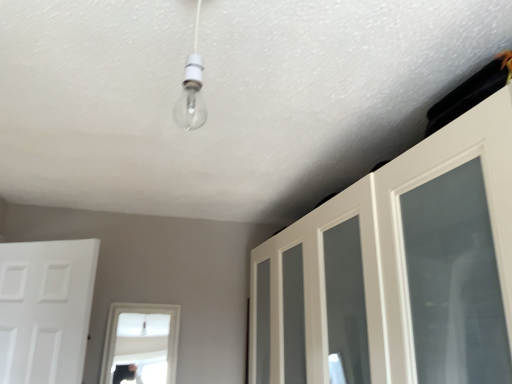
Question: In terms of width, does white matte door at left, the first door viewed from the left, look wider or thinner when compared to white glossy cabinet at upper right, which appears as the 1th door when viewed from the right?

Choices:
 (A) thin
 (B) wide

Answer: (A)

Question: Is white matte door at left, the second door when ordered from right to left, taller or shorter than white glossy cabinet at upper right, which appears as the 1th door when viewed from the right?

Choices:
 (A) tall
 (B) short

Answer: (B)

Question: From a real-world perspective, relative to white glossy cabinet at upper right, which appears as the 1th door when viewed from the right, is white matte door at left, the second door when ordered from right to left, vertically above or below?

Choices:
 (A) above
 (B) below

Answer: (B)

Question: Looking at the image, does white glossy cabinet at upper right, marked as the 2th door in a left-to-right arrangement, seem bigger or smaller compared to white matte door at left, the second door when ordered from right to left?

Choices:
 (A) small
 (B) big

Answer: (B)

Question: From a real-world perspective, relative to white matte door at left, the first door viewed from the left, is white glossy cabinet at upper right, marked as the 2th door in a left-to-right arrangement, vertically above or below?

Choices:
 (A) above
 (B) below

Answer: (A)

Question: Is point (293, 332) closer or farther from the camera than point (51, 243)?

Choices:
 (A) closer
 (B) farther

Answer: (A)

Question: From the image's perspective, relative to white matte door at left, the second door when ordered from right to left, is white glossy cabinet at upper right, marked as the 2th door in a left-to-right arrangement, above or below?

Choices:
 (A) above
 (B) below

Answer: (A)